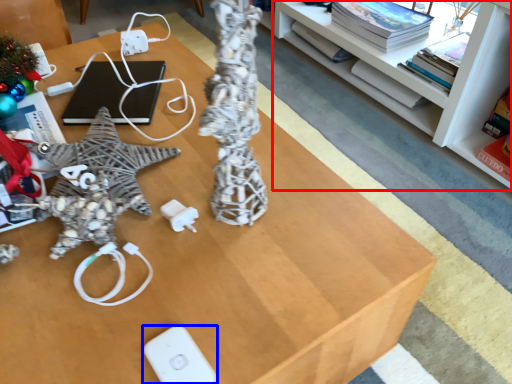
Question: Which object appears closest to the camera in this image, shelf (highlighted by a red box) or Wii controller (highlighted by a blue box)?

Choices:
 (A) shelf
 (B) Wii controller

Answer: (B)